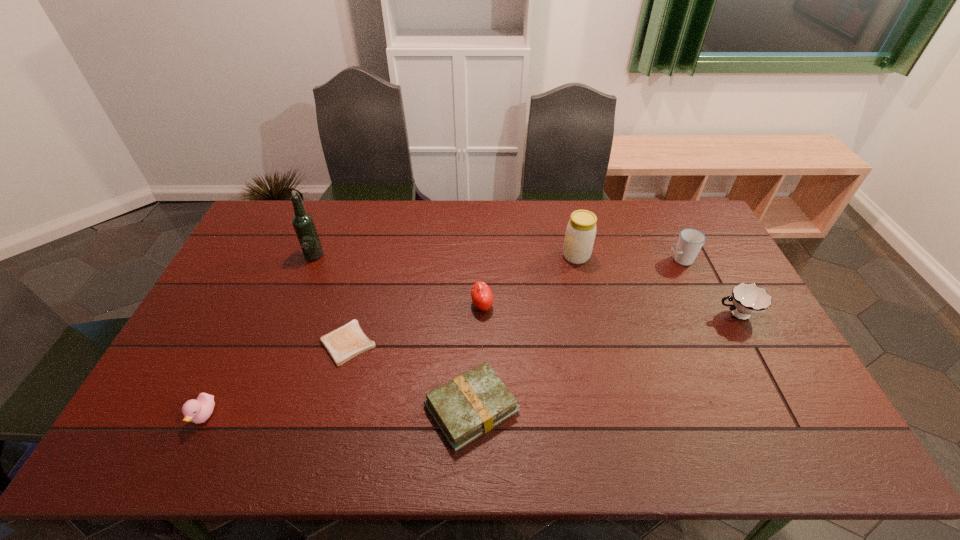
The width and height of the screenshot is (960, 540). Identify the location of the seventh object from right to left. (303, 223).

The height and width of the screenshot is (540, 960). I want to click on beer bottle, so click(303, 223).

Identify the location of jar. (580, 234).

Find the location of a particular element. This screenshot has width=960, height=540. the third object from right to left is located at coordinates (580, 234).

Image resolution: width=960 pixels, height=540 pixels. Identify the location of the taller cup. (690, 241).

This screenshot has width=960, height=540. Identify the location of apple. (482, 297).

The height and width of the screenshot is (540, 960). I want to click on the shorter cup, so click(x=748, y=299).

This screenshot has height=540, width=960. In order to click on the leftmost object in this screenshot , I will do `click(197, 411)`.

The image size is (960, 540). I want to click on the sixth tallest object, so click(x=197, y=411).

The width and height of the screenshot is (960, 540). Identify the location of book. pos(470,405).